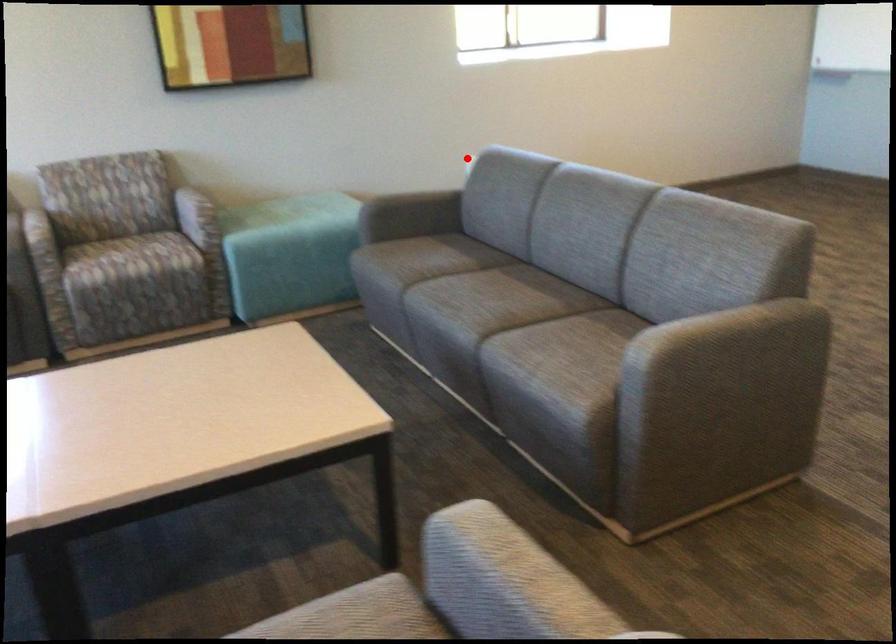
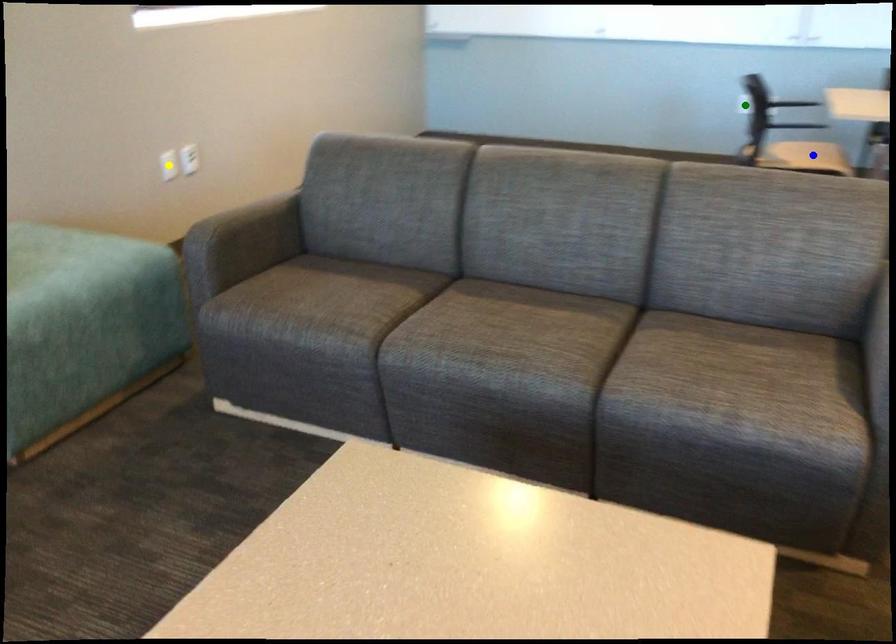
Question: I am providing you with two images of the same scene from different viewpoints. A red point is marked on the first image. You are given multiple points on the second image. Which point in image 2 is actually the same real-world point as the red point in image 1?

Choices:
 (A) green point
 (B) blue point
 (C) yellow point

Answer: (C)